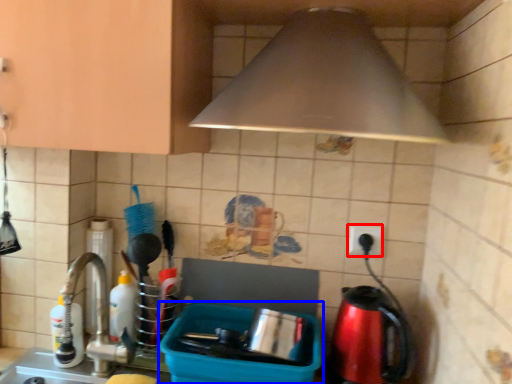
Question: Which object is further to the camera taking this photo, electric outlet (highlighted by a red box) or appliance (highlighted by a blue box)?

Choices:
 (A) electric outlet
 (B) appliance

Answer: (A)